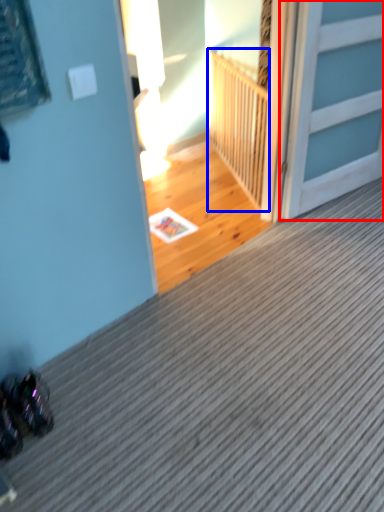
Question: Among these objects, which one is nearest to the camera, door (highlighted by a red box) or balustrade (highlighted by a blue box)?

Choices:
 (A) door
 (B) balustrade

Answer: (A)